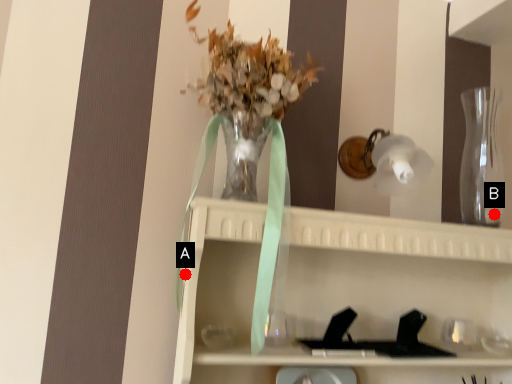
Question: Two points are circled on the image, labeled by A and B beside each circle. Which point is closer to the camera?

Choices:
 (A) A is closer
 (B) B is closer

Answer: (A)